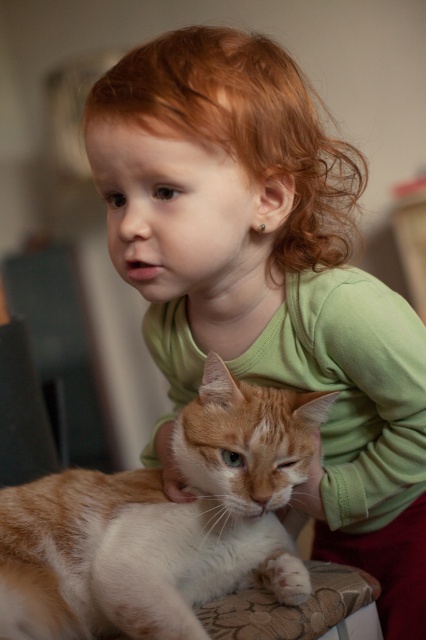
Question: Where is orange-white fur cat at lower left located in relation to curly red hair at upper center in the image?

Choices:
 (A) right
 (B) left

Answer: (B)

Question: Does orange-white fur cat at lower left appear under curly red hair at upper center?

Choices:
 (A) yes
 (B) no

Answer: (A)

Question: Among these points, which one is farthest from the camera?

Choices:
 (A) (163, 54)
 (B) (294, 593)

Answer: (B)

Question: Can you confirm if orange-white fur cat at lower left is positioned below white fluffy paw at lower center?

Choices:
 (A) no
 (B) yes

Answer: (A)

Question: Which point is farther to the camera?

Choices:
 (A) (203, 112)
 (B) (273, 582)
 (C) (14, 627)

Answer: (B)

Question: Which of these objects is positioned closest to the white fluffy paw at lower center?

Choices:
 (A) orange-white fur cat at lower left
 (B) curly red hair at upper center

Answer: (A)